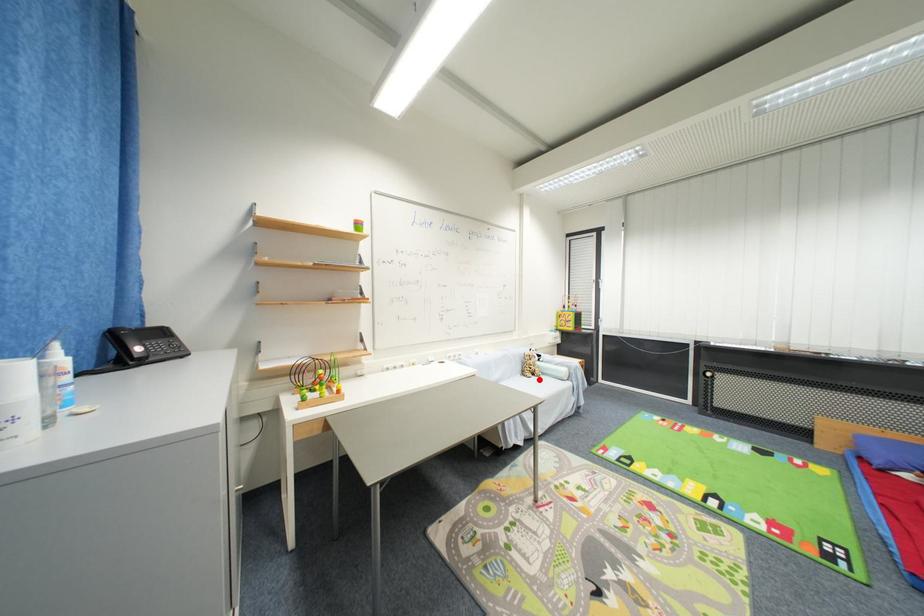
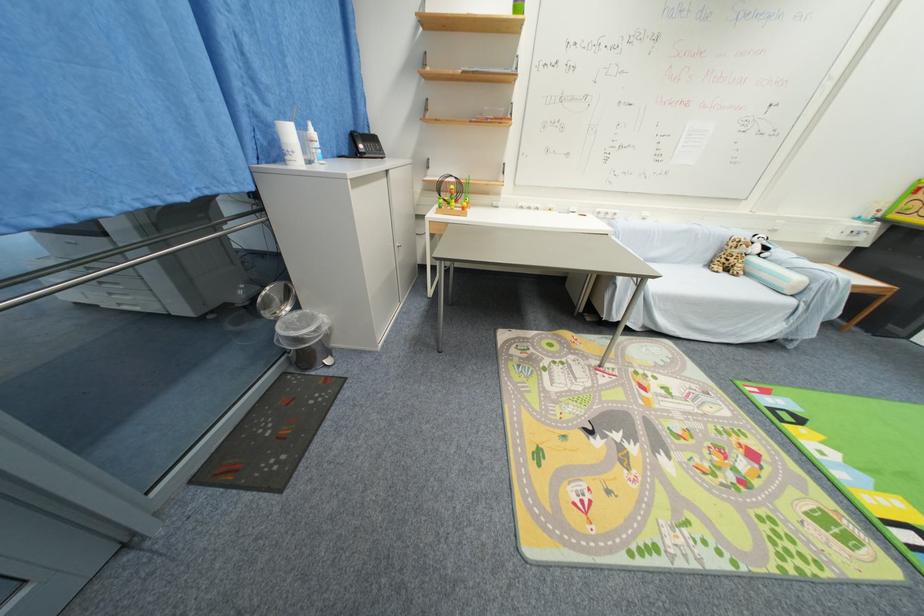
The point at the highlighted location is marked in the first image. Where is the corresponding point in the second image?

(730, 276)